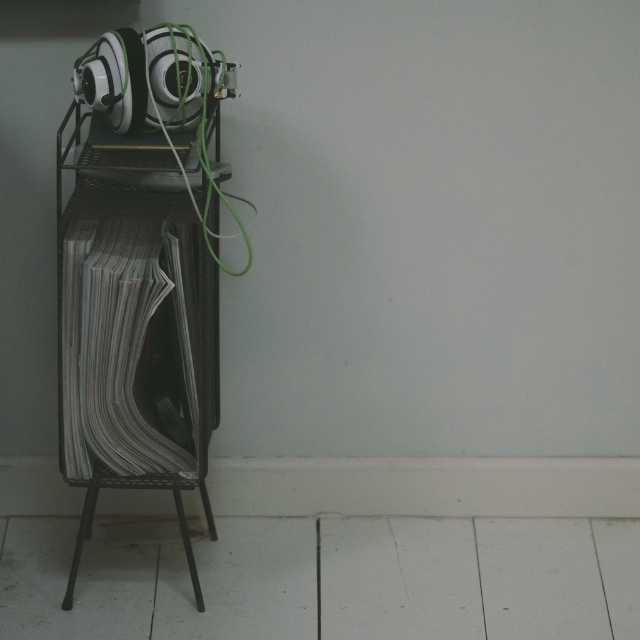
Question: Which point is closer to the camera?

Choices:
 (A) metallic stool at lower left
 (B) satin silver headphones at upper left

Answer: (B)

Question: Which of the following is the closest to the observer?

Choices:
 (A) satin silver headphones at upper left
 (B) metallic stool at lower left

Answer: (A)

Question: Can you confirm if satin silver headphones at upper left is thinner than metallic stool at lower left?

Choices:
 (A) no
 (B) yes

Answer: (B)

Question: Is satin silver headphones at upper left further to camera compared to metallic stool at lower left?

Choices:
 (A) yes
 (B) no

Answer: (B)

Question: Which point is farther to the camera?

Choices:
 (A) (65, 605)
 (B) (179, 72)

Answer: (A)

Question: Is satin silver headphones at upper left smaller than metallic stool at lower left?

Choices:
 (A) yes
 (B) no

Answer: (A)